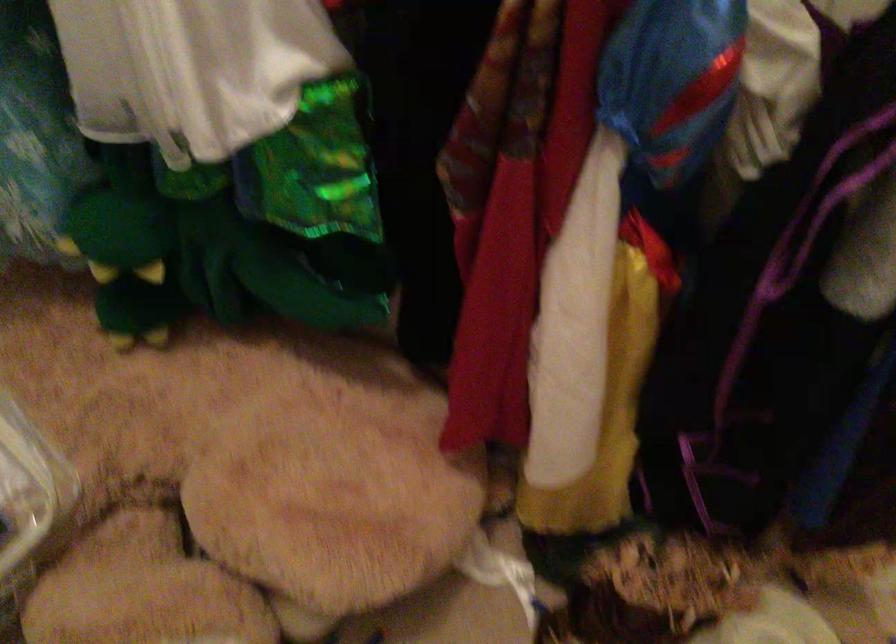
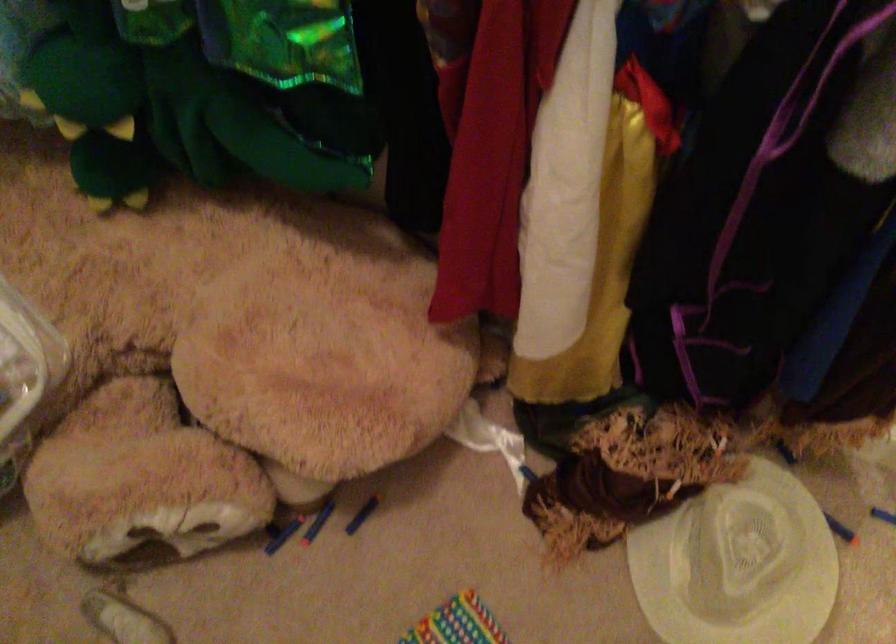
Question: The images are taken continuously from a first-person perspective. In which direction is your viewpoint rotating?

Choices:
 (A) Left
 (B) Right
 (C) Up
 (D) Down

Answer: (D)